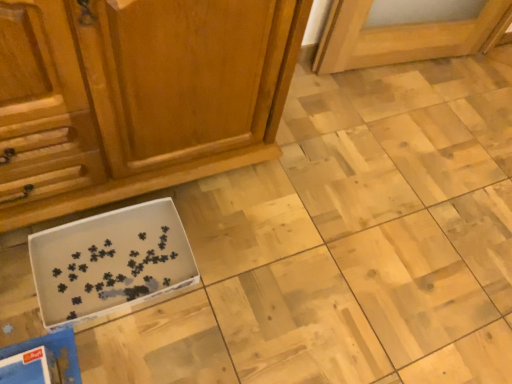
Question: From a real-world perspective, is wooden cabinet at lower left physically above white cardboard box at lower left?

Choices:
 (A) no
 (B) yes

Answer: (B)

Question: Is wooden cabinet at lower left outside white cardboard box at lower left?

Choices:
 (A) no
 (B) yes

Answer: (B)

Question: Is wooden cabinet at lower left beside white cardboard box at lower left?

Choices:
 (A) yes
 (B) no

Answer: (B)

Question: Is wooden cabinet at lower left in front of white cardboard box at lower left?

Choices:
 (A) no
 (B) yes

Answer: (B)

Question: Considering the relative sizes of wooden cabinet at lower left and white cardboard box at lower left in the image provided, is wooden cabinet at lower left wider than white cardboard box at lower left?

Choices:
 (A) no
 (B) yes

Answer: (B)

Question: Is wooden cabinet at lower left oriented away from white cardboard box at lower left?

Choices:
 (A) yes
 (B) no

Answer: (B)

Question: Is the depth of white cardboard box at lower left less than that of wooden cabinet at lower left?

Choices:
 (A) yes
 (B) no

Answer: (B)

Question: From a real-world perspective, is white cardboard box at lower left on top of wooden cabinet at lower left?

Choices:
 (A) yes
 (B) no

Answer: (B)

Question: Are white cardboard box at lower left and wooden cabinet at lower left far apart?

Choices:
 (A) no
 (B) yes

Answer: (A)

Question: From the image's perspective, is white cardboard box at lower left on top of wooden cabinet at lower left?

Choices:
 (A) yes
 (B) no

Answer: (B)

Question: Is white cardboard box at lower left facing away from wooden cabinet at lower left?

Choices:
 (A) no
 (B) yes

Answer: (A)

Question: Considering the relative positions of white cardboard box at lower left and wooden cabinet at lower left in the image provided, is white cardboard box at lower left behind wooden cabinet at lower left?

Choices:
 (A) yes
 (B) no

Answer: (A)

Question: Looking at the image, does wooden cabinet at lower left seem bigger or smaller compared to white cardboard box at lower left?

Choices:
 (A) small
 (B) big

Answer: (B)